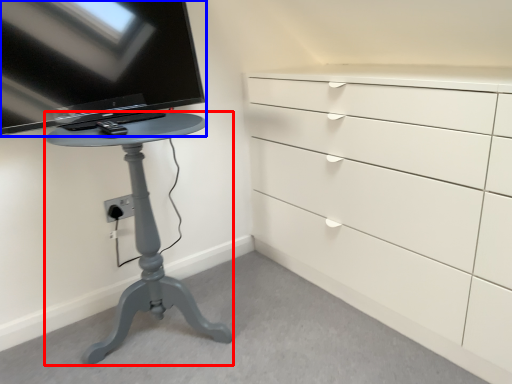
Question: Which point is closer to the camera, furniture (highlighted by a red box) or television (highlighted by a blue box)?

Choices:
 (A) furniture
 (B) television

Answer: (A)